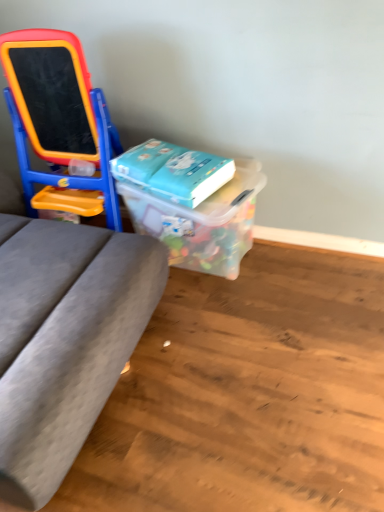
What is the approximate width of matte plastic easel at left?

14.99 inches.

The width and height of the screenshot is (384, 512). In order to click on blue matte book at center in this screenshot , I will do `click(173, 170)`.

Locate an element on the screen. The image size is (384, 512). matte plastic easel at left is located at coordinates (60, 123).

Who is taller, blue matte book at center or translucent plastic container at center?

translucent plastic container at center.

How far apart are blue matte book at center and translucent plastic container at center?

A distance of 6.58 inches exists between blue matte book at center and translucent plastic container at center.

From the image's perspective, is blue matte book at center above or below translucent plastic container at center?

Clearly, from the image's perspective, blue matte book at center is above translucent plastic container at center.

Can you confirm if blue matte book at center is thinner than translucent plastic container at center?

Yes, blue matte book at center is thinner than translucent plastic container at center.

Are matte plastic easel at left and blue matte book at center making contact?

No.

Which object is further away from the camera, matte plastic easel at left or blue matte book at center?

blue matte book at center is further away from the camera.

Considering the sizes of objects matte plastic easel at left and blue matte book at center in the image provided, who is wider, matte plastic easel at left or blue matte book at center?

With larger width is matte plastic easel at left.

Is matte plastic easel at left outside of blue matte book at center?

matte plastic easel at left lies outside blue matte book at center's area.

From the image's perspective, which is above, blue matte book at center or matte plastic easel at left?

matte plastic easel at left, from the image's perspective.

Is point (144, 174) positioned before point (43, 90)?

That is True.

Choose the correct answer: Is blue matte book at center inside matte plastic easel at left or outside it?

blue matte book at center is not inside matte plastic easel at left, it's outside.

Would you consider blue matte book at center to be distant from matte plastic easel at left?

Actually, blue matte book at center and matte plastic easel at left are a little close together.

Considering the sizes of translucent plastic container at center and blue matte book at center in the image, is translucent plastic container at center wider or thinner than blue matte book at center?

In the image, translucent plastic container at center appears to be wider than blue matte book at center.

How many degrees apart are the facing directions of translucent plastic container at center and blue matte book at center?

The facing directions of translucent plastic container at center and blue matte book at center are 16.8 degrees apart.

The height and width of the screenshot is (512, 384). I want to click on box on the right of blue matte book at center, so click(201, 221).

Who is more distant, translucent plastic container at center or blue matte book at center?

Positioned behind is blue matte book at center.

Could you tell me if translucent plastic container at center is turned towards matte plastic easel at left?

No.

Does translucent plastic container at center have a lesser height compared to matte plastic easel at left?

Indeed, translucent plastic container at center has a lesser height compared to matte plastic easel at left.

From the image's perspective, is translucent plastic container at center positioned above or below matte plastic easel at left?

translucent plastic container at center is below matte plastic easel at left.

Consider the image. Is there a large distance between translucent plastic container at center and matte plastic easel at left?

They are positioned close to each other.

Is translucent plastic container at center at the back of matte plastic easel at left?

No, matte plastic easel at left's orientation is not away from translucent plastic container at center.

Is translucent plastic container at center completely or partially inside matte plastic easel at left?

That's incorrect, translucent plastic container at center is not inside matte plastic easel at left.

How different are the orientations of matte plastic easel at left and translucent plastic container at center in degrees?

They differ by 1.81 degrees in their facing directions.

From the image's perspective, which one is positioned higher, matte plastic easel at left or translucent plastic container at center?

From the image's view, matte plastic easel at left is above.

In order to click on book above the translucent plastic container at center (from the image's perspective) in this screenshot , I will do coord(173,170).

The width and height of the screenshot is (384, 512). In order to click on book located behind the matte plastic easel at left in this screenshot , I will do `click(173, 170)`.

When comparing their distances from matte plastic easel at left, does translucent plastic container at center or blue matte book at center seem further?

Based on the image, translucent plastic container at center appears to be further to matte plastic easel at left.

Estimate the real-world distances between objects in this image. Which object is closer to translucent plastic container at center, matte plastic easel at left or blue matte book at center?

The object closer to translucent plastic container at center is blue matte book at center.

Considering their positions, is blue matte book at center positioned further to translucent plastic container at center than matte plastic easel at left?

matte plastic easel at left.

From the image, which object appears to be farther from blue matte book at center, translucent plastic container at center or matte plastic easel at left?

matte plastic easel at left.

Looking at the image, which one is located closer to blue matte book at center, matte plastic easel at left or translucent plastic container at center?

Among the two, translucent plastic container at center is located nearer to blue matte book at center.

From the image, which object appears to be nearer to matte plastic easel at left, blue matte book at center or translucent plastic container at center?

Among the two, blue matte book at center is located nearer to matte plastic easel at left.

Identify the location of book located between matte plastic easel at left and translucent plastic container at center in the left-right direction. The image size is (384, 512). (173, 170).